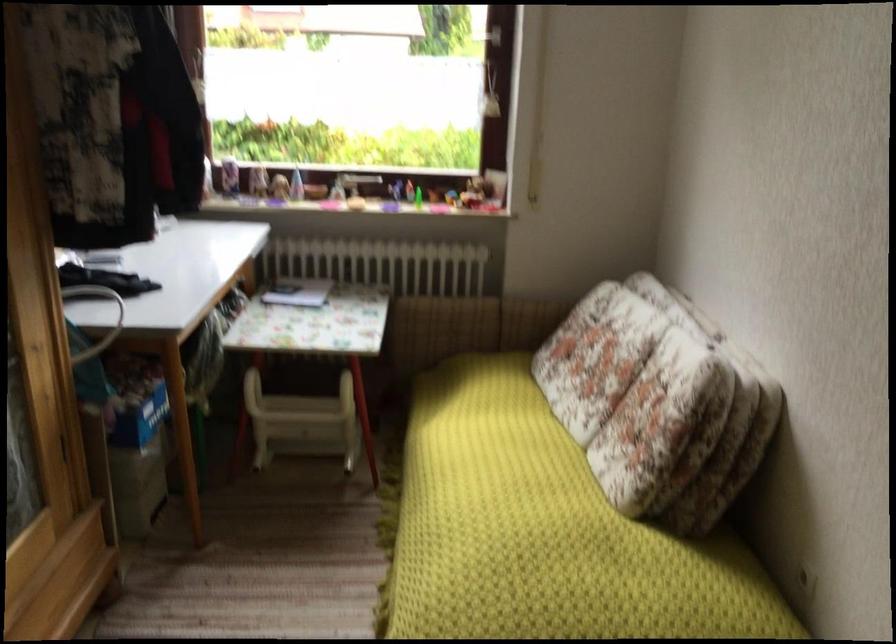
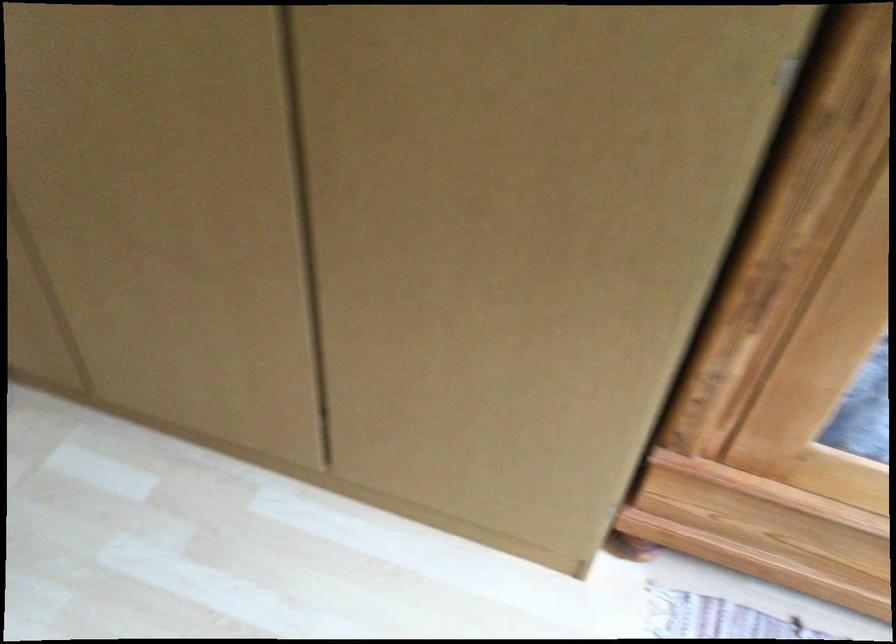
The images are taken continuously from a first-person perspective. In which direction is your viewpoint rotating?

The rotation direction of the camera is left-down.